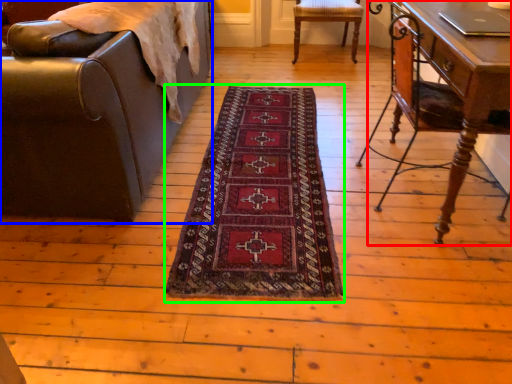
Question: Estimate the real-world distances between objects in this image. Which object is closer to table (highlighted by a red box), chair (highlighted by a blue box) or mat (highlighted by a green box)?

Choices:
 (A) chair
 (B) mat

Answer: (B)